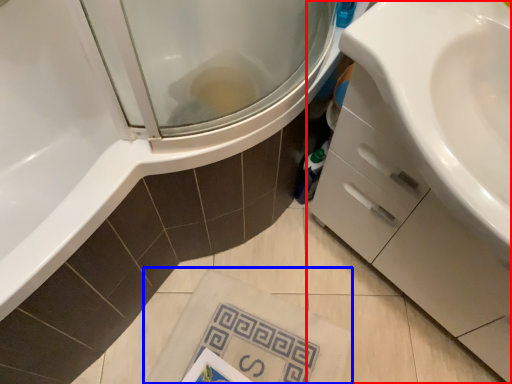
Question: Which object appears closest to the camera in this image, bathroom cabinet (highlighted by a red box) or beach towel (highlighted by a blue box)?

Choices:
 (A) bathroom cabinet
 (B) beach towel

Answer: (A)